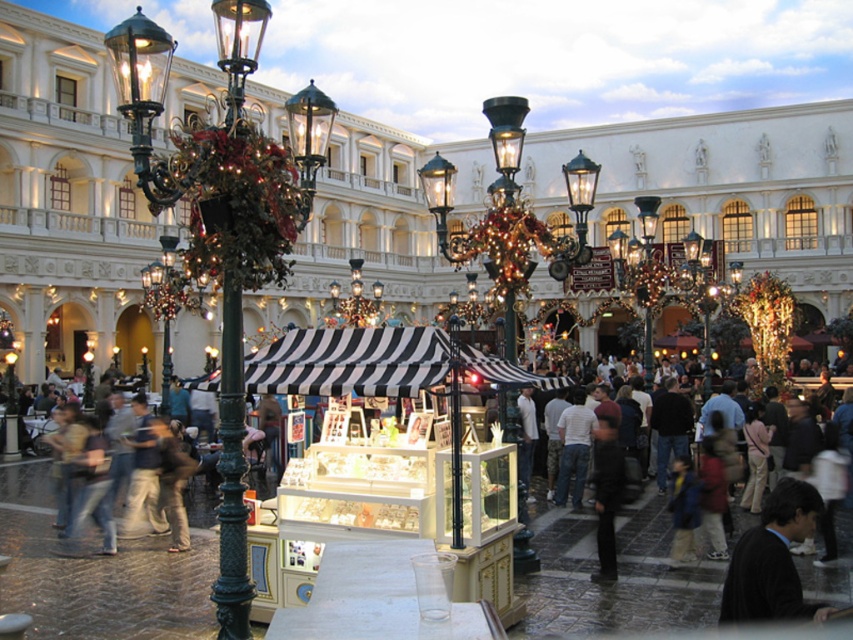
In the scene shown: Is dark blue suit at lower right above black matte jacket at center?

Correct, dark blue suit at lower right is located above black matte jacket at center.

Is point (776, 596) positioned in front of point (602, 544)?

Yes, it is.

Find the location of a particular element. The width and height of the screenshot is (853, 640). dark blue suit at lower right is located at coordinates (772, 561).

In the scene shown: Is polished brass lamp post at left closer to camera compared to dark blue suit at lower right?

No, polished brass lamp post at left is further to the viewer.

Can you confirm if polished brass lamp post at left is wider than dark blue suit at lower right?

Yes.

Which is behind, point (239, 3) or point (766, 509)?

Point (766, 509)

Find the location of a particular element. Image resolution: width=853 pixels, height=640 pixels. polished brass lamp post at left is located at coordinates (223, 221).

Is polished brass lamp post at left bigger than polished brass lamp post at center?

Yes, polished brass lamp post at left is bigger than polished brass lamp post at center.

Which is behind, point (247, 616) or point (584, 189)?

Point (584, 189)

Describe the element at coordinates (223, 221) in the screenshot. I see `polished brass lamp post at left` at that location.

Find the location of a particular element. polished brass lamp post at left is located at coordinates (223, 221).